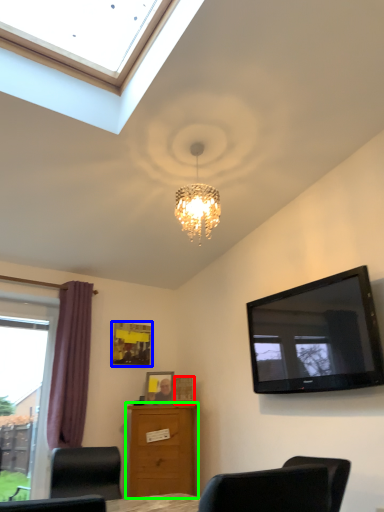
Question: Which object is the closest to the picture frame (highlighted by a red box)? Choose among these: picture frame (highlighted by a blue box) or chest of drawers (highlighted by a green box).

Choices:
 (A) picture frame
 (B) chest of drawers

Answer: (B)